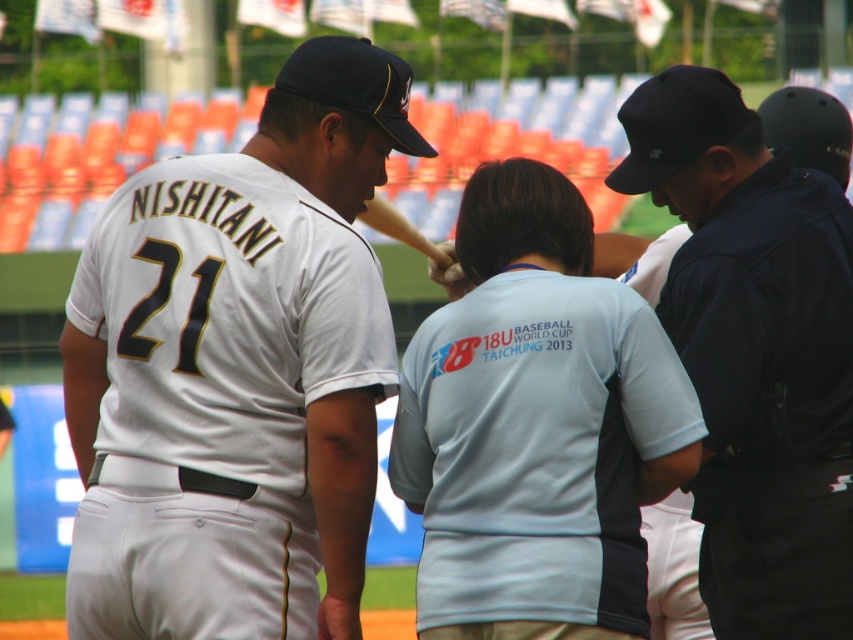
Is white jersey at center positioned in front of dark blue uniform at center?

That is True.

Does white jersey at center lie behind dark blue uniform at center?

No, white jersey at center is in front of dark blue uniform at center.

What do you see at coordinates (242, 360) in the screenshot? The height and width of the screenshot is (640, 853). I see `white jersey at center` at bounding box center [242, 360].

Locate an element on the screen. The height and width of the screenshot is (640, 853). white jersey at center is located at coordinates (242, 360).

Can you confirm if white jersey at center is thinner than light blue fabric shirt at center?

Incorrect, white jersey at center's width is not less than light blue fabric shirt at center's.

Who is more forward, [300,618] or [495,344]?

Point [495,344] is in front.

Describe the element at coordinates (242, 360) in the screenshot. This screenshot has width=853, height=640. I see `white jersey at center` at that location.

Locate an element on the screen. This screenshot has height=640, width=853. white jersey at center is located at coordinates (242, 360).

Which is more to the right, dark blue uniform at center or light blue fabric shirt at center?

From the viewer's perspective, dark blue uniform at center appears more on the right side.

Locate an element on the screen. dark blue uniform at center is located at coordinates (755, 353).